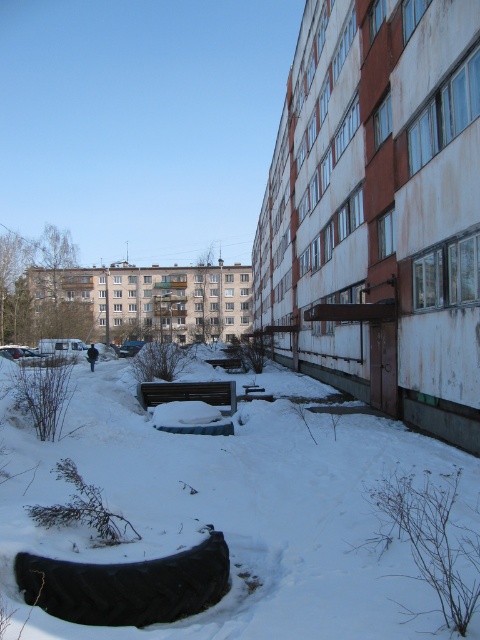
Question: Can you confirm if white fluffy snow at center is bigger than black rubber tire at lower left?

Choices:
 (A) yes
 (B) no

Answer: (A)

Question: Is white fluffy snow at center positioned at the back of black rubber tire at lower left?

Choices:
 (A) yes
 (B) no

Answer: (B)

Question: Is white fluffy snow at center bigger than black rubber tire at lower left?

Choices:
 (A) yes
 (B) no

Answer: (A)

Question: Among these points, which one is farthest from the camera?

Choices:
 (A) (135, 625)
 (B) (184, 467)

Answer: (B)